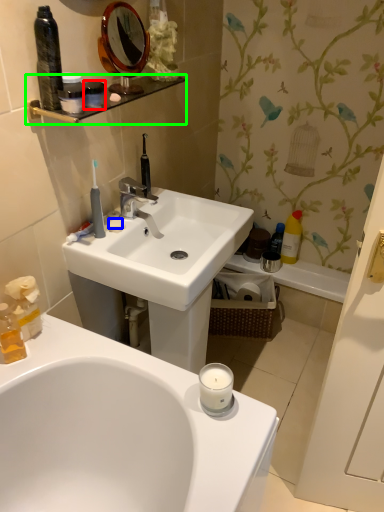
Question: Which object is the closest to the mouthwash (highlighted by a red box)? Choose among these: soap (highlighted by a blue box) or balustrade (highlighted by a green box).

Choices:
 (A) soap
 (B) balustrade

Answer: (B)